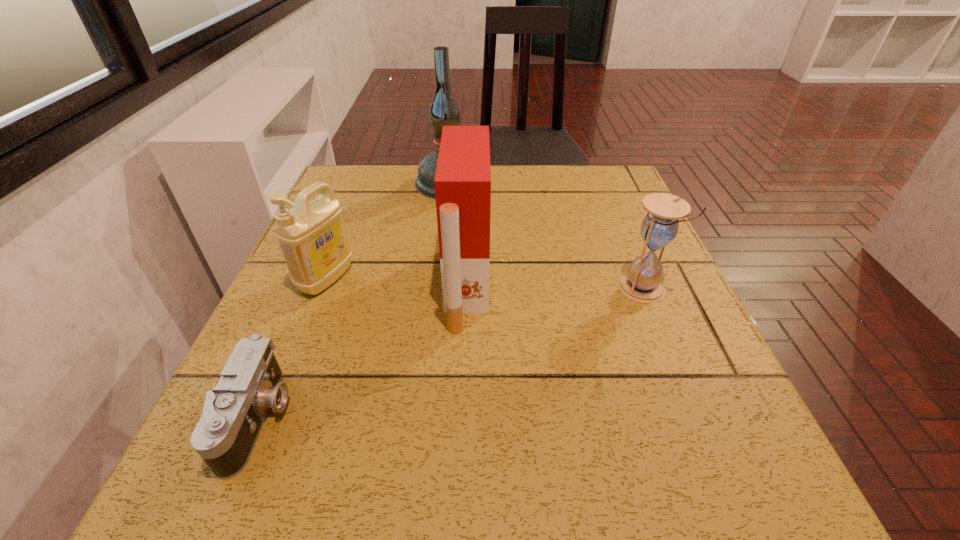
Identify the location of unoccupied area between the rightmost object and the farthest object. The height and width of the screenshot is (540, 960). (545, 236).

Choose which object is the third nearest neighbor to the camera. Please provide its 2D coordinates. Your answer should be formatted as a tuple, i.e. [(x, y)], where the tuple contains the x and y coordinates of a point satisfying the conditions above.

[(444, 111)]

This screenshot has width=960, height=540. What are the coordinates of `object identified as the fourth closest to the hourglass` in the screenshot? It's located at (233, 414).

The image size is (960, 540). Find the location of `free space that satisfies the following two spatial constraints: 1. on the front-facing side of the fourth shortest object; 2. on the left side of the hourglass`. free space that satisfies the following two spatial constraints: 1. on the front-facing side of the fourth shortest object; 2. on the left side of the hourglass is located at coordinates (468, 288).

Identify the location of vacant space that satisfies the following two spatial constraints: 1. on the front-facing side of the rightmost object; 2. on the left side of the fourth shortest object. The height and width of the screenshot is (540, 960). (468, 288).